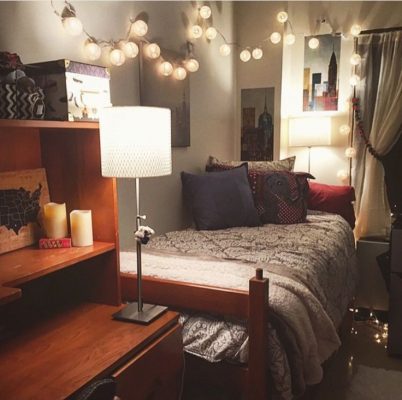
Locate an element on the screen. This screenshot has width=402, height=400. pillow is located at coordinates (211, 222).